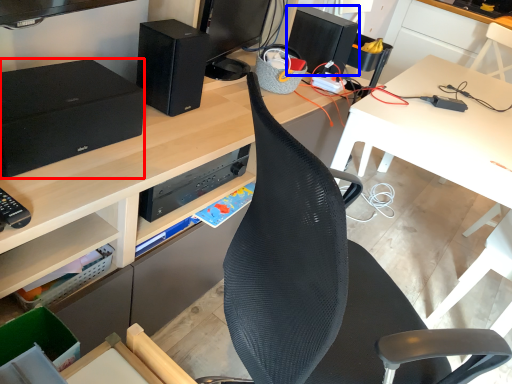
Question: Which object appears farthest to the camera in this image, speaker (highlighted by a red box) or speaker (highlighted by a blue box)?

Choices:
 (A) speaker
 (B) speaker

Answer: (B)